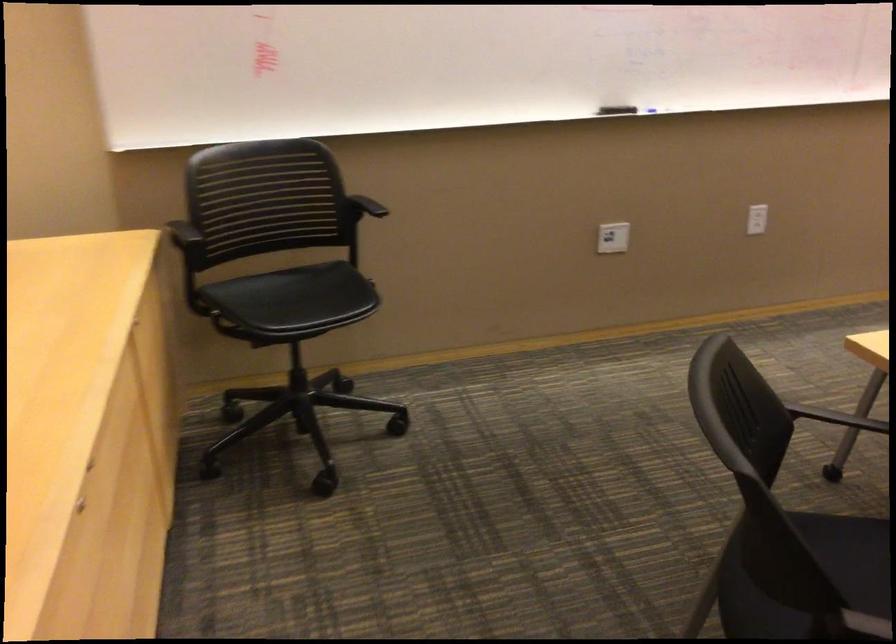
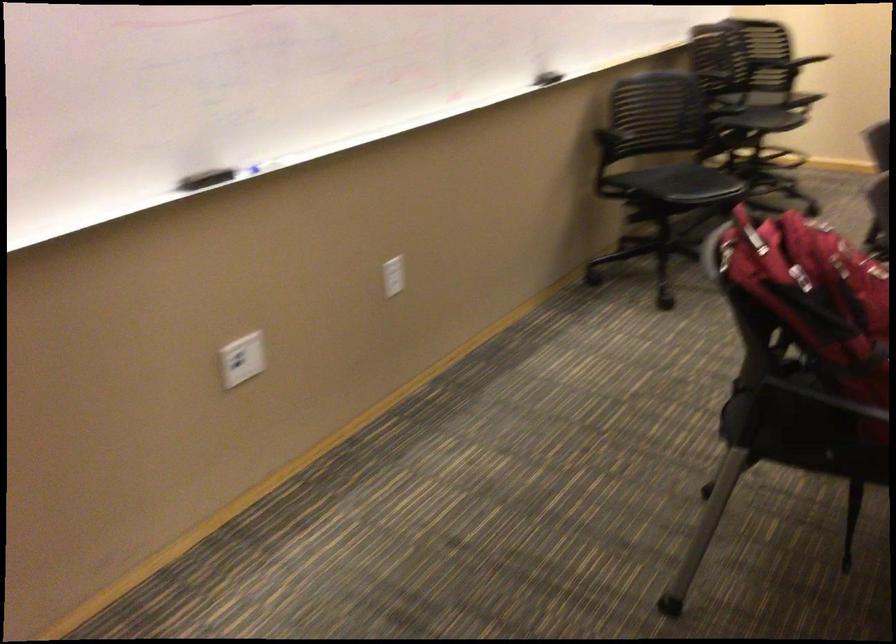
Where in the second image is the point corresponding to (x=745, y=213) from the first image?

(392, 276)